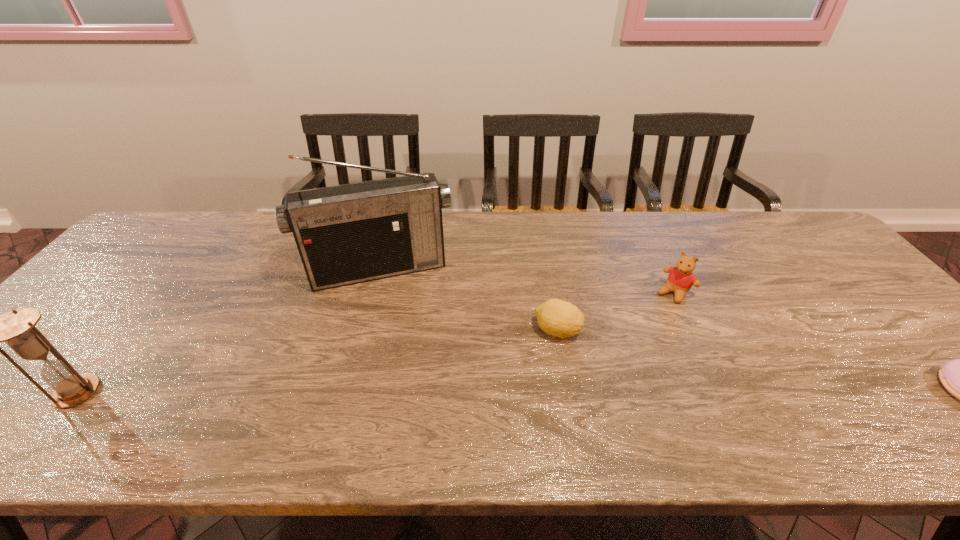
At what (x,y) coordinates should I click in order to perform the action: click on object that is at the left edge. Please return your answer as a coordinate pair (x, y). Looking at the image, I should click on (17, 328).

I want to click on object that is at the near left corner, so click(x=17, y=328).

Find the location of a particular element. This screenshot has width=960, height=540. vacant region at the far edge is located at coordinates (627, 254).

In the image, there is a desktop. Where is `free region at the near edge`? This screenshot has height=540, width=960. free region at the near edge is located at coordinates (699, 394).

Identify the location of vacant space at the right edge. (869, 298).

You are a GUI agent. You are given a task and a screenshot of the screen. Output one action in this format:
    pyautogui.click(x=<x>, y=<y>)
    Task: Click on the vacant space at the far left corner
    The height and width of the screenshot is (540, 960).
    Given the screenshot: What is the action you would take?
    pyautogui.click(x=212, y=215)

Image resolution: width=960 pixels, height=540 pixels. Identify the location of unoccupied position between the third shortest object and the tallest object. (527, 281).

Image resolution: width=960 pixels, height=540 pixels. Find the location of `vacant space that's between the leftmost object and the radio receiver`. vacant space that's between the leftmost object and the radio receiver is located at coordinates (228, 331).

What are the coordinates of `free area in between the tallest object and the third tallest object` in the screenshot? It's located at (527, 281).

I want to click on empty space that is in between the fourth shortest object and the fourth object from right to left, so click(228, 331).